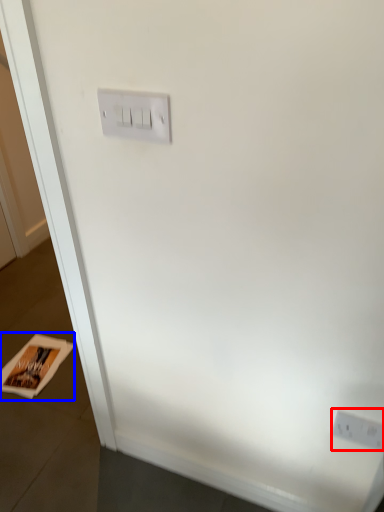
Question: Which object is further to the camera taking this photo, power plugs and sockets (highlighted by a red box) or magazine (highlighted by a blue box)?

Choices:
 (A) power plugs and sockets
 (B) magazine

Answer: (B)